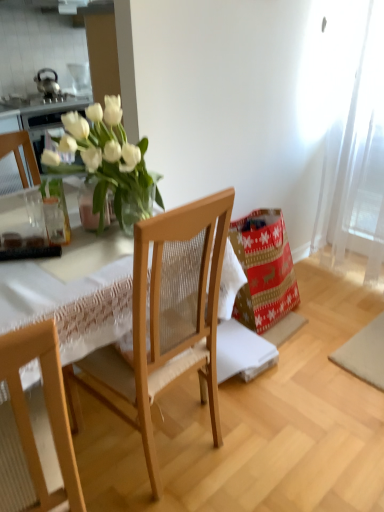
Question: Considering the positions of point (89, 184) and point (266, 218), is point (89, 184) closer or farther from the camera than point (266, 218)?

Choices:
 (A) farther
 (B) closer

Answer: (B)

Question: Is clear glass vase at center inside or outside of red and gold paper bag at lower right?

Choices:
 (A) inside
 (B) outside

Answer: (B)

Question: Which object is the farthest from the clear glass vase at left?

Choices:
 (A) clear glass vase at center
 (B) red and gold paper bag at lower right
 (C) wooden chair at center
 (D) white sheer curtain at right

Answer: (D)

Question: Which object is positioned closest to the wooden chair at center?

Choices:
 (A) clear glass vase at left
 (B) red and gold paper bag at lower right
 (C) white sheer curtain at right
 (D) clear glass vase at center

Answer: (D)